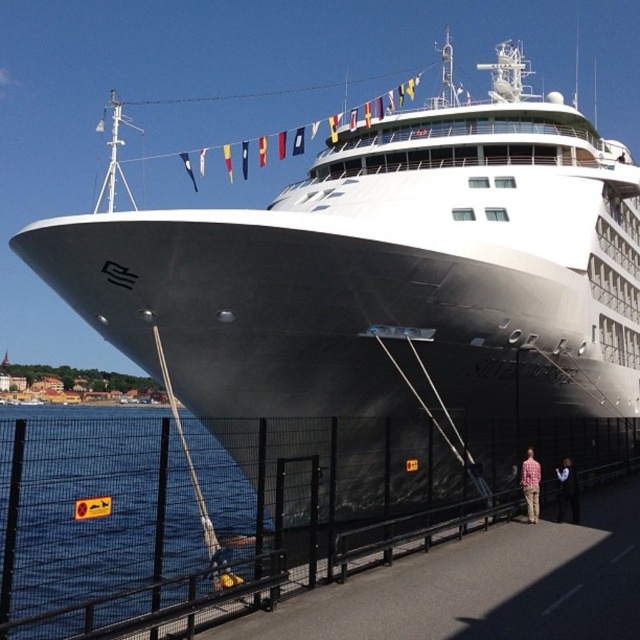
You are standing on the pier next to the cruise ship and want to locate the black suit at lower right. According to the coordinates provided, where should you look relative to the ship?

The black suit at lower right is located at coordinates point (566, 492), which places it near the lower right corner of the image frame, close to the pier where you are standing.

You are a passenger on the cruise ship Silver Whisper. You want to jump into the blue water at lower left from the ship. The ship has a railing that is 50 feet above the water. Can you safely jump without hitting the deck? Please explain your reasoning.

The distance between the ship and the blue water at lower left is 51.34 feet. Since the railing is only 50 feet above the water, jumping from there would mean you would fall short and hit the deck instead of reaching the water.